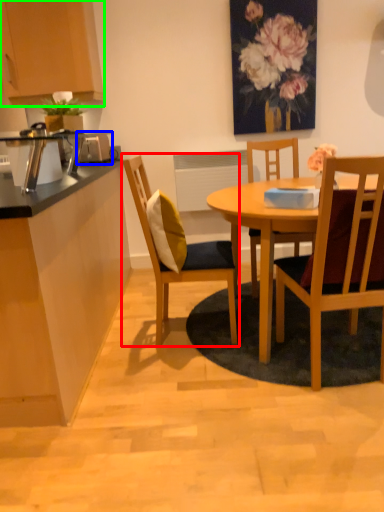
Question: Which is farther away from chair (highlighted by a red box)? appliance (highlighted by a blue box) or cabinetry (highlighted by a green box)?

Choices:
 (A) appliance
 (B) cabinetry

Answer: (B)